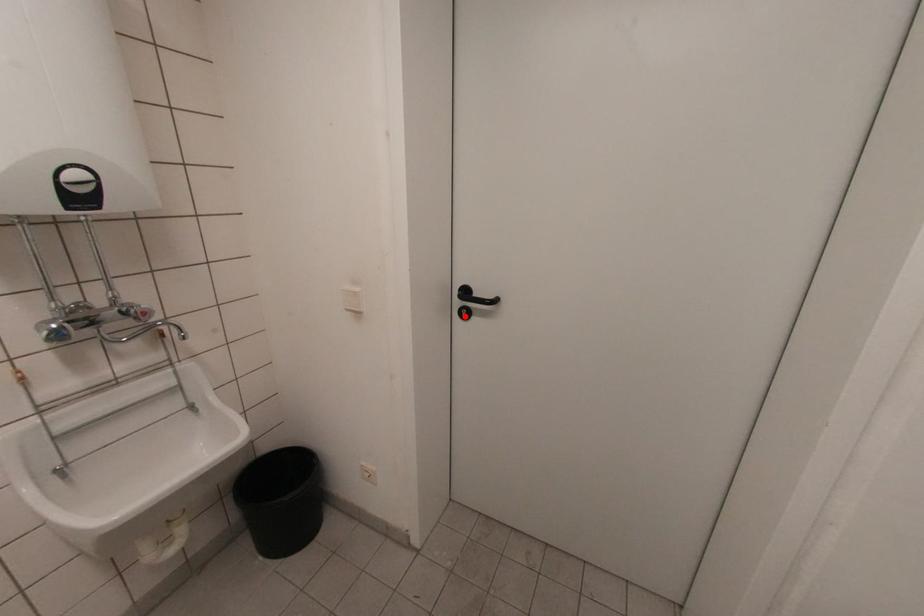
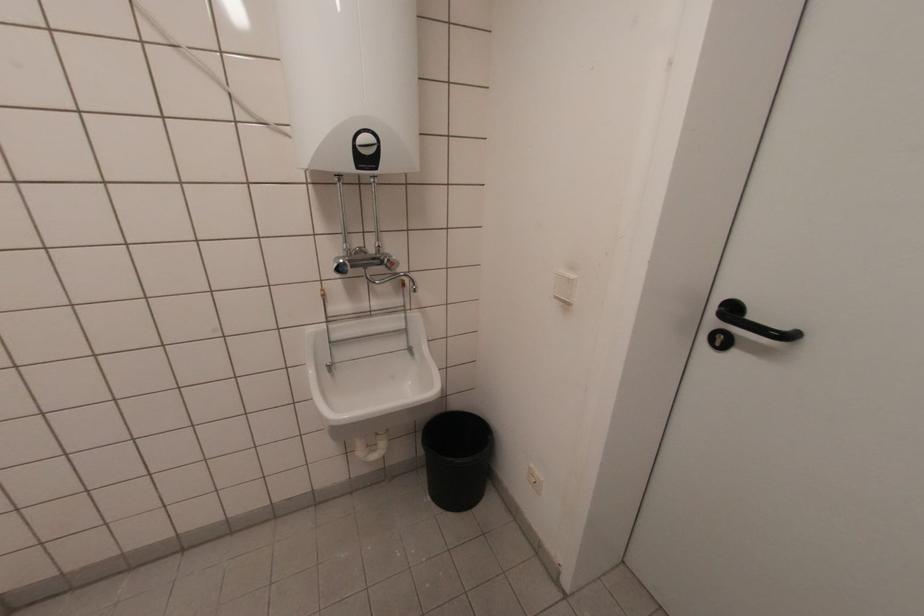
In the second image, find the point that corresponds to the highlighted location in the first image.

(719, 344)